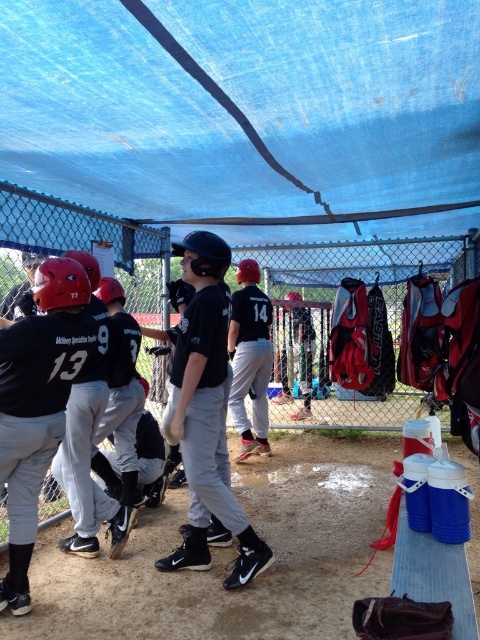
Based on the photo, you are a photographer trying to capture a photo of the black matte uniform at center and the brown leather baseball glove at lower center. Since you want to ensure both are clearly visible, which object should you focus on first considering their sizes?

The black matte uniform at center has a greater height compared to the brown leather baseball glove at lower center, so you should focus on the black matte uniform at center first because it is larger and might require more attention to capture details.

You are standing at the point marked at coordinate point (184, 449) and want to throw a ball to your teammate who is 3.07 meters away. Is this distance within the recommended 3 meters for a safe throw to avoid injury?

Yes, the distance between you and your teammate is exactly 3.07 meters, which is slightly over the recommended 3 meters for a safe throw. To avoid injury, it is advisable to keep the distance within 3 meters.